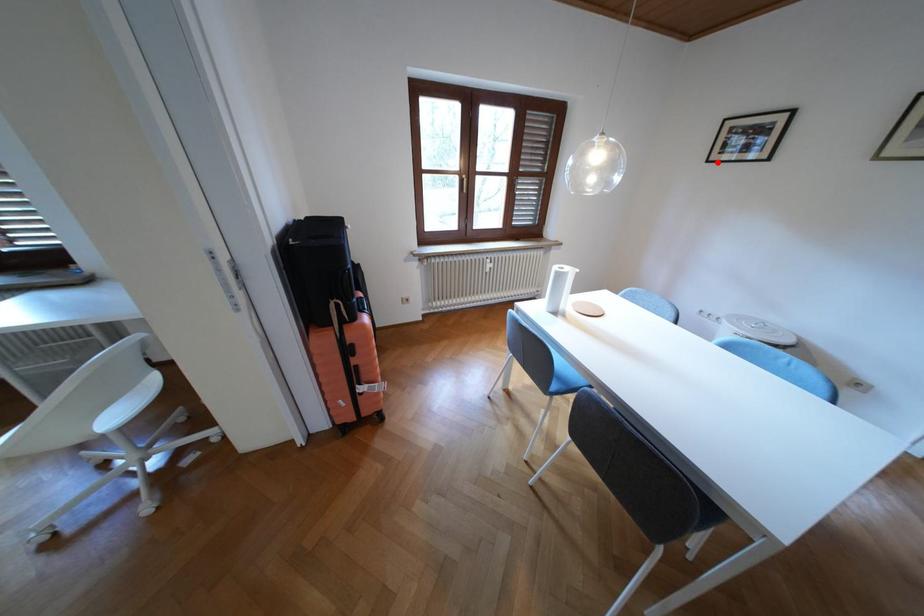
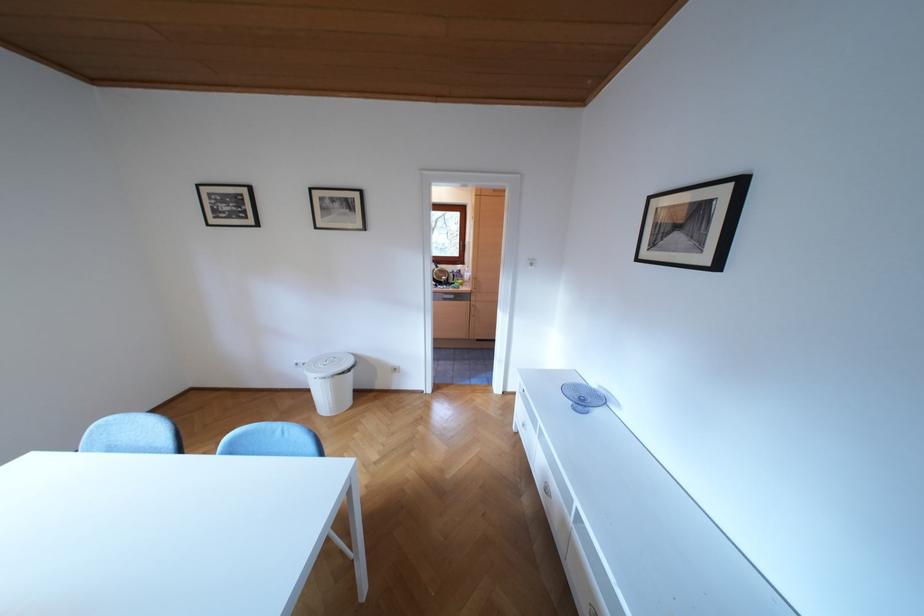
Find the pixel in the second image that matches the highlighted location in the first image.

(219, 225)